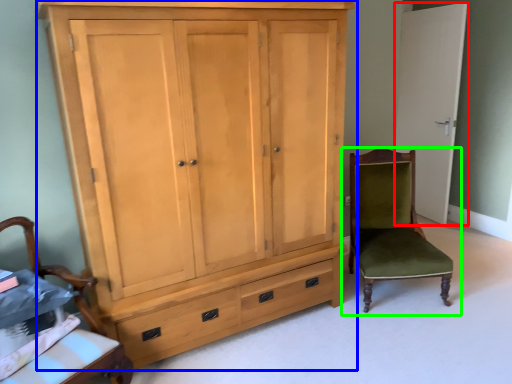
Question: Which is farther away from door (highlighted by a red box)? cupboard (highlighted by a blue box) or chair (highlighted by a green box)?

Choices:
 (A) cupboard
 (B) chair

Answer: (A)